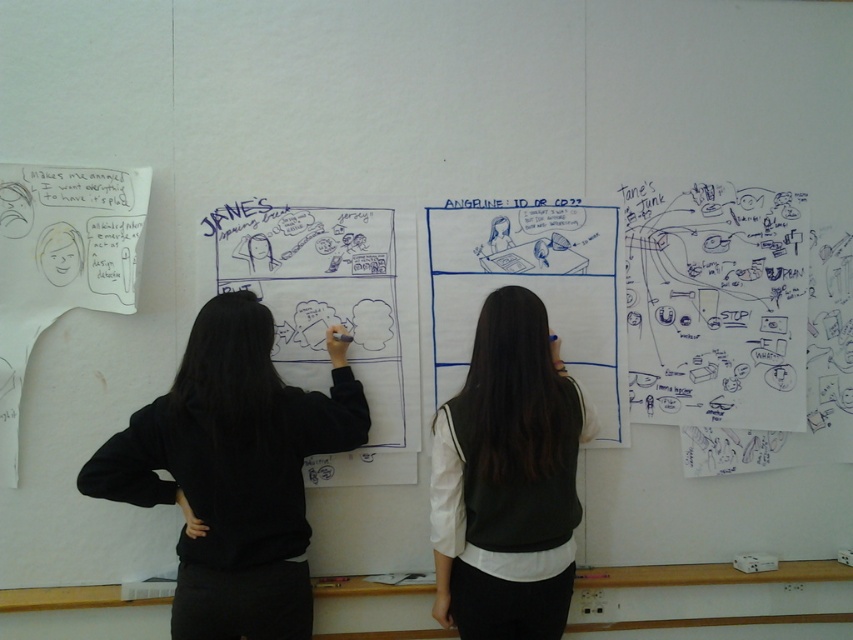
Question: Among these points, which one is nearest to the camera?

Choices:
 (A) (x=440, y=595)
 (B) (x=234, y=518)

Answer: (B)

Question: Is black matte jacket at left smaller than white matte vest at center?

Choices:
 (A) yes
 (B) no

Answer: (B)

Question: Which object appears farthest from the camera in this image?

Choices:
 (A) black matte jacket at left
 (B) white matte vest at center

Answer: (B)

Question: Does black matte jacket at left appear on the right side of white matte vest at center?

Choices:
 (A) no
 (B) yes

Answer: (A)

Question: Can you confirm if black matte jacket at left is smaller than white matte vest at center?

Choices:
 (A) yes
 (B) no

Answer: (B)